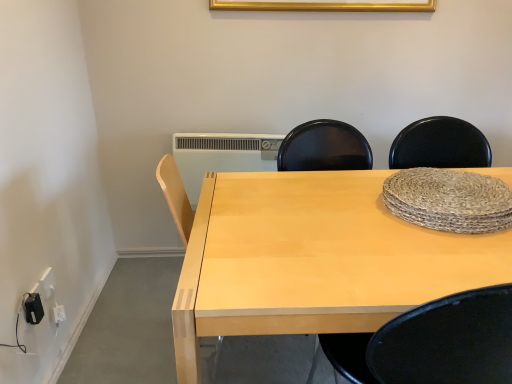
In order to face light wood desk at center, should I rotate leftwards or rightwards?

Turn right by 18.962 degrees to look at light wood desk at center.

Where is `gold metallic picture frame at upper center`? The height and width of the screenshot is (384, 512). gold metallic picture frame at upper center is located at coordinates (325, 5).

Where is `light wood desk at center`? This screenshot has height=384, width=512. light wood desk at center is located at coordinates (314, 259).

From a real-world perspective, between gold metallic picture frame at upper center and white plastic radiator at center, who is vertically higher?

gold metallic picture frame at upper center.

From the image's perspective, which is below, gold metallic picture frame at upper center or white plastic radiator at center?

white plastic radiator at center is shown below in the image.

Considering the sizes of gold metallic picture frame at upper center and white plastic radiator at center in the image, is gold metallic picture frame at upper center bigger or smaller than white plastic radiator at center?

gold metallic picture frame at upper center is smaller than white plastic radiator at center.

Is point (367, 4) positioned in front of point (224, 160)?

Yes, it is.

Who is more distant, white plastic electric outlet at lower left, the 2th electric outlet in the right-to-left sequence, or light wood desk at center?

white plastic electric outlet at lower left, the 2th electric outlet in the right-to-left sequence, is more distant.

Considering the positions of objects white plastic electric outlet at lower left, the 1th electric outlet in the back-to-front sequence, and light wood desk at center in the image provided, who is more to the right, white plastic electric outlet at lower left, the 1th electric outlet in the back-to-front sequence, or light wood desk at center?

From the viewer's perspective, light wood desk at center appears more on the right side.

Is white plastic electric outlet at lower left, marked as the first electric outlet in a left-to-right arrangement, positioned with its back to light wood desk at center?

white plastic electric outlet at lower left, marked as the first electric outlet in a left-to-right arrangement, is not turned away from light wood desk at center.

Looking at this image, from the image's perspective, relative to gold metallic picture frame at upper center, is black plastic electric outlet at lower left, the first electric outlet when ordered from front to back, above or below?

black plastic electric outlet at lower left, the first electric outlet when ordered from front to back, is below gold metallic picture frame at upper center.

Is black plastic electric outlet at lower left, positioned as the 2th electric outlet in left-to-right order, closer to camera compared to gold metallic picture frame at upper center?

Yes, it is in front of gold metallic picture frame at upper center.

Is black plastic electric outlet at lower left, the 2th electric outlet when ordered from back to front, at the right side of gold metallic picture frame at upper center?

Incorrect, black plastic electric outlet at lower left, the 2th electric outlet when ordered from back to front, is not on the right side of gold metallic picture frame at upper center.

Based on the photo, how different are the orientations of black plastic electric outlet at lower left, which ranks as the 1th electric outlet in right-to-left order, and gold metallic picture frame at upper center in degrees?

black plastic electric outlet at lower left, which ranks as the 1th electric outlet in right-to-left order, and gold metallic picture frame at upper center are facing 87 degrees away from each other.

Is white plastic radiator at center facing away from light wood desk at center?

No, white plastic radiator at center is not facing away from light wood desk at center.

Where is `desk that appears on the right of white plastic radiator at center`? This screenshot has width=512, height=384. desk that appears on the right of white plastic radiator at center is located at coordinates (314, 259).

How many degrees apart are the facing directions of white plastic radiator at center and light wood desk at center?

white plastic radiator at center and light wood desk at center are facing 0.822 degrees away from each other.

Who is bigger, white plastic radiator at center or light wood desk at center?

Bigger between the two is light wood desk at center.

From a real-world perspective, who is located lower, light wood desk at center or white plastic radiator at center?

In real-world perspective, light wood desk at center is lower.

Identify the location of radiator lying on the left of light wood desk at center. The width and height of the screenshot is (512, 384). (221, 156).

Would you say light wood desk at center is inside or outside white plastic radiator at center?

light wood desk at center is outside white plastic radiator at center.

Measure the distance between white plastic electric outlet at lower left, the 1th electric outlet in the back-to-front sequence, and gold metallic picture frame at upper center.

white plastic electric outlet at lower left, the 1th electric outlet in the back-to-front sequence, and gold metallic picture frame at upper center are 5.11 feet apart from each other.

From the image's perspective, is white plastic electric outlet at lower left, the 2th electric outlet in the right-to-left sequence, positioned above or below gold metallic picture frame at upper center?

From the image's perspective, white plastic electric outlet at lower left, the 2th electric outlet in the right-to-left sequence, appears below gold metallic picture frame at upper center.

Where is `picture frame on the right of white plastic electric outlet at lower left, the 1th electric outlet in the back-to-front sequence`? This screenshot has width=512, height=384. picture frame on the right of white plastic electric outlet at lower left, the 1th electric outlet in the back-to-front sequence is located at coordinates click(x=325, y=5).

Does point (47, 283) appear closer or farther from the camera than point (265, 2)?

Clearly, point (47, 283) is closer to the camera than point (265, 2).

Which is in front, point (310, 195) or point (42, 279)?

The point (310, 195) is more forward.

From a real-world perspective, who is located lower, light wood desk at center or white plastic electric outlet at lower left, marked as the first electric outlet in a left-to-right arrangement?

white plastic electric outlet at lower left, marked as the first electric outlet in a left-to-right arrangement.

Between light wood desk at center and white plastic electric outlet at lower left, the 1th electric outlet in the back-to-front sequence, which one has less height?

white plastic electric outlet at lower left, the 1th electric outlet in the back-to-front sequence.

Does light wood desk at center appear on the right side of white plastic electric outlet at lower left, the 1th electric outlet in the back-to-front sequence?

Indeed, light wood desk at center is positioned on the right side of white plastic electric outlet at lower left, the 1th electric outlet in the back-to-front sequence.

At what (x,y) coordinates should I click in order to perform the action: click on radiator on the left of the gold metallic picture frame at upper center. Please return your answer as a coordinate pair (x, y). The image size is (512, 384). Looking at the image, I should click on tap(221, 156).

The height and width of the screenshot is (384, 512). Find the location of `the 2nd electric outlet above the light wood desk at center (from the image's perspective)`. the 2nd electric outlet above the light wood desk at center (from the image's perspective) is located at coordinates (47, 283).

Estimate the real-world distances between objects in this image. Which object is closer to gold metallic picture frame at upper center, black plastic electric outlet at lower left, the 2th electric outlet when ordered from back to front, or light wood desk at center?

light wood desk at center is positioned closer to the anchor gold metallic picture frame at upper center.

From the image, which object appears to be nearer to white plastic radiator at center, light wood desk at center or white plastic electric outlet at lower left, the 2th electric outlet in the right-to-left sequence?

light wood desk at center is closer to white plastic radiator at center.

From the image, which object appears to be nearer to light wood desk at center, white plastic electric outlet at lower left, the 2th electric outlet in the right-to-left sequence, or black plastic electric outlet at lower left, the 2th electric outlet when ordered from back to front?

The object closer to light wood desk at center is black plastic electric outlet at lower left, the 2th electric outlet when ordered from back to front.

When comparing their distances from white plastic radiator at center, does black plastic electric outlet at lower left, positioned as the 2th electric outlet in left-to-right order, or white plastic electric outlet at lower left, the 2th electric outlet in the right-to-left sequence, seem closer?

Among the two, white plastic electric outlet at lower left, the 2th electric outlet in the right-to-left sequence, is located nearer to white plastic radiator at center.

Estimate the real-world distances between objects in this image. Which object is closer to gold metallic picture frame at upper center, white plastic electric outlet at lower left, the 1th electric outlet in the back-to-front sequence, or white plastic radiator at center?

Based on the image, white plastic radiator at center appears to be nearer to gold metallic picture frame at upper center.

From the image, which object appears to be nearer to black plastic electric outlet at lower left, the 2th electric outlet when ordered from back to front, light wood desk at center or white plastic electric outlet at lower left, the 2th electric outlet in the right-to-left sequence?

Based on the image, white plastic electric outlet at lower left, the 2th electric outlet in the right-to-left sequence, appears to be nearer to black plastic electric outlet at lower left, the 2th electric outlet when ordered from back to front.

When comparing their distances from light wood desk at center, does gold metallic picture frame at upper center or white plastic radiator at center seem further?

gold metallic picture frame at upper center.

When comparing their distances from black plastic electric outlet at lower left, which ranks as the 1th electric outlet in right-to-left order, does gold metallic picture frame at upper center or white plastic electric outlet at lower left, marked as the first electric outlet in a left-to-right arrangement, seem further?

gold metallic picture frame at upper center is positioned further to the anchor black plastic electric outlet at lower left, which ranks as the 1th electric outlet in right-to-left order.

Find the location of a particular element. The height and width of the screenshot is (384, 512). electric outlet that lies between gold metallic picture frame at upper center and black plastic electric outlet at lower left, the 2th electric outlet when ordered from back to front, from top to bottom is located at coordinates (47, 283).

Where is `electric outlet between white plastic electric outlet at lower left, marked as the first electric outlet in a left-to-right arrangement, and light wood desk at center, in the horizontal direction`? This screenshot has width=512, height=384. electric outlet between white plastic electric outlet at lower left, marked as the first electric outlet in a left-to-right arrangement, and light wood desk at center, in the horizontal direction is located at coordinates (33, 308).

Where is `electric outlet located between black plastic electric outlet at lower left, positioned as the 2th electric outlet in left-to-right order, and white plastic radiator at center in the depth direction`? electric outlet located between black plastic electric outlet at lower left, positioned as the 2th electric outlet in left-to-right order, and white plastic radiator at center in the depth direction is located at coordinates (47, 283).

The width and height of the screenshot is (512, 384). I want to click on radiator between gold metallic picture frame at upper center and black plastic electric outlet at lower left, the first electric outlet when ordered from front to back, from top to bottom, so click(x=221, y=156).